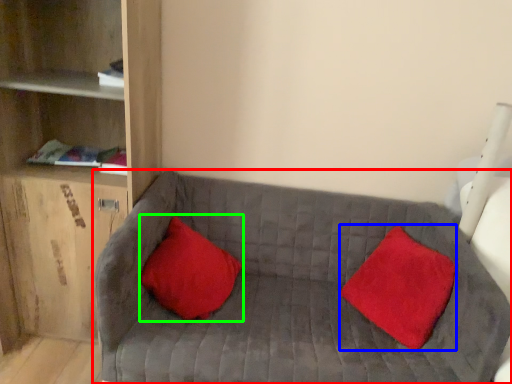
Question: Estimate the real-world distances between objects in this image. Which object is farther from studio couch (highlighted by a red box), pillow (highlighted by a blue box) or pillow (highlighted by a green box)?

Choices:
 (A) pillow
 (B) pillow

Answer: (A)